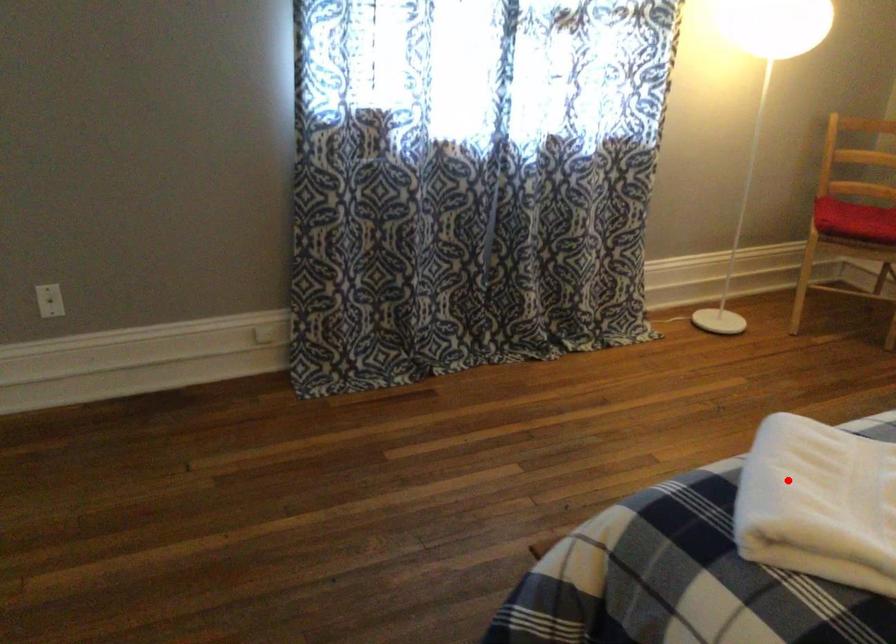
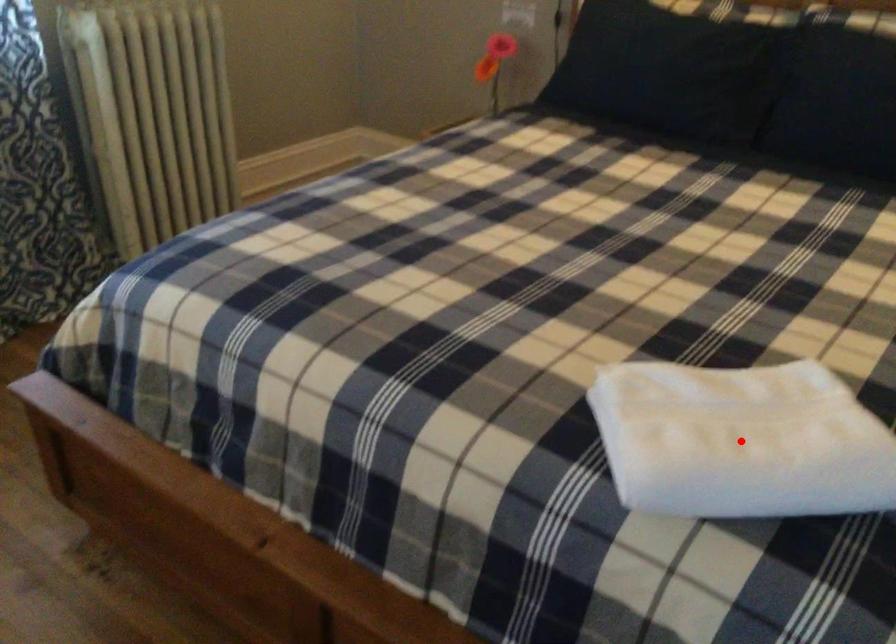
I am providing you with two images of the same scene from different viewpoints. A red point is marked on the first image and another point is marked on the second image. Is the red point in image1 aligned with the point shown in image2?

Yes